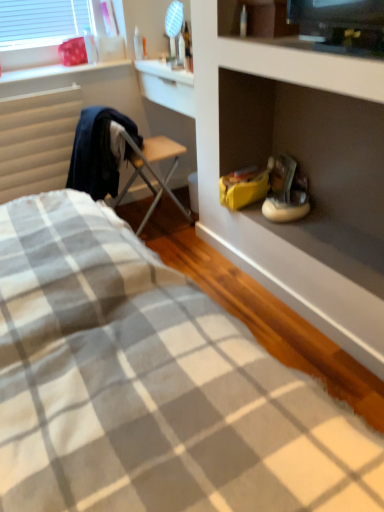
You are a GUI agent. You are given a task and a screenshot of the screen. Output one action in this format:
    pyautogui.click(x=<x>, y=<y>)
    Task: Click on the free location above matte white cabinet at upper right (from a real-world perspective)
    This screenshot has height=512, width=384.
    Given the screenshot: What is the action you would take?
    pyautogui.click(x=303, y=39)